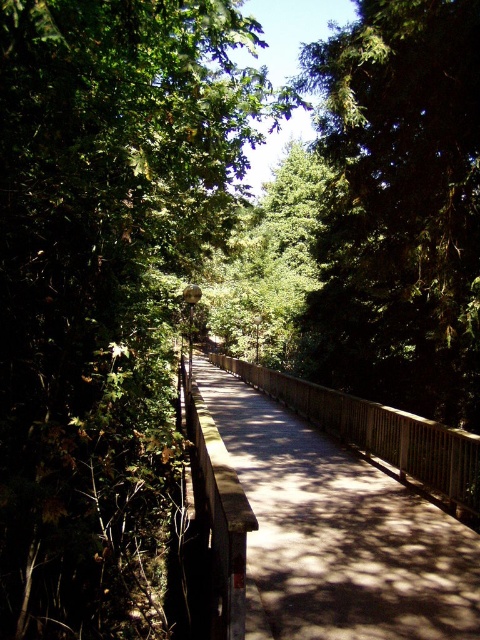
The image size is (480, 640). What do you see at coordinates (398, 209) in the screenshot?
I see `green textured tree at center` at bounding box center [398, 209].

Who is higher up, green textured tree at center or wooden bridge at center?

green textured tree at center

Image resolution: width=480 pixels, height=640 pixels. Find the location of `green textured tree at center`. green textured tree at center is located at coordinates (398, 209).

Is point (61, 550) closer to camera compared to point (384, 328)?

Yes, point (61, 550) is closer to viewer.

Does point (66, 547) lie behind point (441, 282)?

No, it is not.

The image size is (480, 640). What do you see at coordinates (105, 285) in the screenshot? I see `green leafy tree at center` at bounding box center [105, 285].

Find the location of a particular element. green leafy tree at center is located at coordinates [x=105, y=285].

In the scene shown: Is green leafy tree at center thinner than wooden bridge at center?

Yes, green leafy tree at center is thinner than wooden bridge at center.

This screenshot has height=640, width=480. Describe the element at coordinates (105, 285) in the screenshot. I see `green leafy tree at center` at that location.

Describe the element at coordinates (105, 285) in the screenshot. I see `green leafy tree at center` at that location.

The height and width of the screenshot is (640, 480). In order to click on green leafy tree at center in this screenshot , I will do (105, 285).